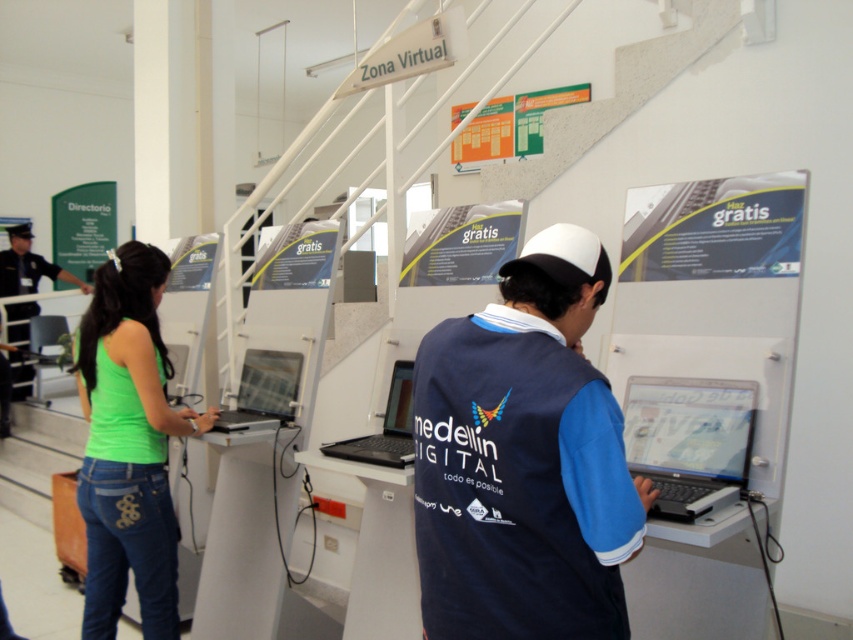
In the scene shown: Measure the distance between green denim jeans at lower left and camera.

green denim jeans at lower left is 2.50 meters from camera.

Can you confirm if green denim jeans at lower left is wider than silver metallic laptop at center?

Indeed, green denim jeans at lower left has a greater width compared to silver metallic laptop at center.

Does point (100, 486) lie in front of point (218, 426)?

That is True.

Find the location of `green denim jeans at lower left`. green denim jeans at lower left is located at coordinates (129, 445).

Does blue fabric vest at center have a lesser width compared to silver metallic laptop at center?

In fact, blue fabric vest at center might be wider than silver metallic laptop at center.

Who is taller, blue fabric vest at center or silver metallic laptop at center?

blue fabric vest at center is taller.

Where is `blue fabric vest at center`? blue fabric vest at center is located at coordinates (523, 460).

What do you see at coordinates (523, 460) in the screenshot? I see `blue fabric vest at center` at bounding box center [523, 460].

Who is more forward, (469, 572) or (39, 268)?

Positioned in front is point (469, 572).

Does point (546, 268) lie in front of point (12, 314)?

That is True.

Image resolution: width=853 pixels, height=640 pixels. Identify the location of blue fabric vest at center. (523, 460).